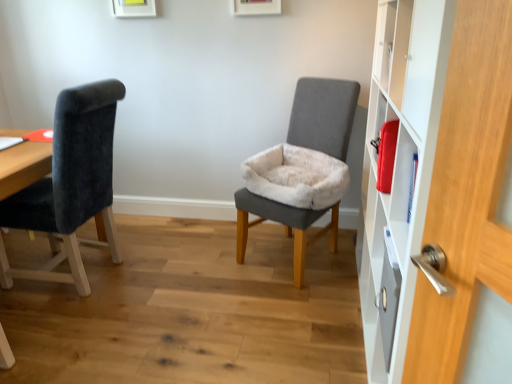
Question: From a real-world perspective, is velvet black chair at left, marked as the first chair in a left-to-right arrangement, under white matte cabinet at right?

Choices:
 (A) no
 (B) yes

Answer: (B)

Question: Can you confirm if velvet black chair at left, which is the 2th chair in right-to-left order, is bigger than white matte cabinet at right?

Choices:
 (A) no
 (B) yes

Answer: (A)

Question: Is velvet black chair at left, marked as the first chair in a left-to-right arrangement, wider than white matte cabinet at right?

Choices:
 (A) no
 (B) yes

Answer: (B)

Question: Can you confirm if velvet black chair at left, which is the 2th chair in right-to-left order, is positioned to the right of white matte cabinet at right?

Choices:
 (A) no
 (B) yes

Answer: (A)

Question: From a real-world perspective, is velvet black chair at left, marked as the first chair in a left-to-right arrangement, on white matte cabinet at right?

Choices:
 (A) yes
 (B) no

Answer: (B)

Question: Considering the relative sizes of velvet black chair at left, marked as the first chair in a left-to-right arrangement, and white matte cabinet at right in the image provided, is velvet black chair at left, marked as the first chair in a left-to-right arrangement, taller than white matte cabinet at right?

Choices:
 (A) no
 (B) yes

Answer: (A)

Question: Can you confirm if white matte cabinet at right is shorter than velvet black chair at left, which is the 2th chair in right-to-left order?

Choices:
 (A) no
 (B) yes

Answer: (A)

Question: Does white matte cabinet at right lie behind velvet black chair at left, which is the 2th chair in right-to-left order?

Choices:
 (A) no
 (B) yes

Answer: (A)

Question: Does white matte cabinet at right touch velvet black chair at left, which is the 2th chair in right-to-left order?

Choices:
 (A) no
 (B) yes

Answer: (A)

Question: Is velvet black chair at left, which is the 2th chair in right-to-left order, at the back of white matte cabinet at right?

Choices:
 (A) no
 (B) yes

Answer: (A)

Question: Could velvet black chair at left, marked as the first chair in a left-to-right arrangement, be considered to be inside white matte cabinet at right?

Choices:
 (A) yes
 (B) no

Answer: (B)

Question: Can you confirm if white matte cabinet at right is positioned to the left of velvet black chair at left, which is the 2th chair in right-to-left order?

Choices:
 (A) yes
 (B) no

Answer: (B)

Question: Is gray fabric chair at center, which is the 1th chair from right to left, facing towards velvet black chair at left, marked as the first chair in a left-to-right arrangement?

Choices:
 (A) no
 (B) yes

Answer: (A)